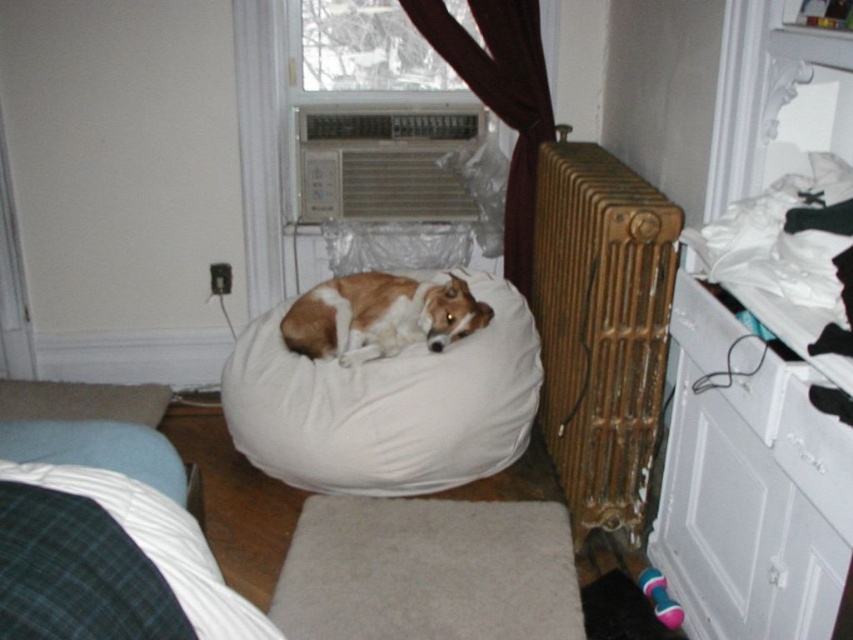
Question: Based on their relative distances, which object is nearer to the white glossy drawer at lower right?

Choices:
 (A) green plaid fabric at lower left
 (B) white plastic heater at upper center

Answer: (A)

Question: Is green plaid fabric at lower left thinner than white plastic heater at upper center?

Choices:
 (A) yes
 (B) no

Answer: (A)

Question: Which point is closer to the camera taking this photo?

Choices:
 (A) (527, 141)
 (B) (778, 472)
 (C) (91, 545)
 (D) (363, 356)

Answer: (C)

Question: Which point is closer to the camera?

Choices:
 (A) (10, 580)
 (B) (424, 131)
 (C) (407, 321)

Answer: (A)

Question: Is green plaid fabric at lower left wider than white plastic heater at upper center?

Choices:
 (A) no
 (B) yes

Answer: (A)

Question: Does gold textured radiator at right have a lesser width compared to white plastic heater at upper center?

Choices:
 (A) yes
 (B) no

Answer: (A)